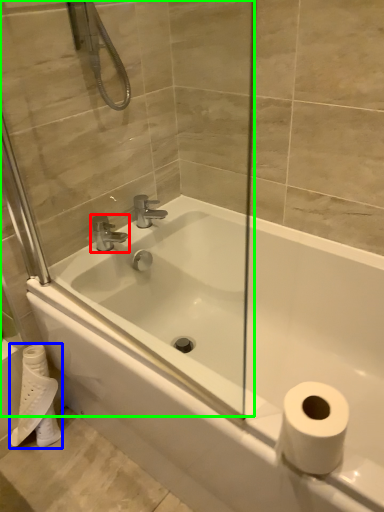
Question: Which object is positioned farthest from tap (highlighted by a red box)? Select from toilet paper (highlighted by a blue box) and glass door (highlighted by a green box).

Choices:
 (A) toilet paper
 (B) glass door

Answer: (A)